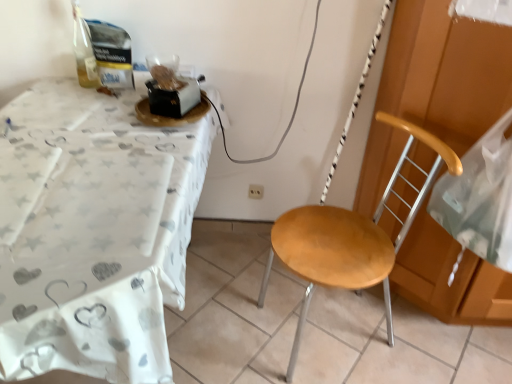
Question: Is white fabric table at left in front of or behind wooden seat at center in the image?

Choices:
 (A) behind
 (B) front

Answer: (B)

Question: Is white fabric table at left wider or thinner than wooden seat at center?

Choices:
 (A) thin
 (B) wide

Answer: (B)

Question: Which is nearer to the transparent plastic bag at right?

Choices:
 (A) white fabric table at left
 (B) white plastic power outlet at center
 (C) wooden seat at center

Answer: (C)

Question: Estimate the real-world distances between objects in this image. Which object is closer to the wooden seat at center?

Choices:
 (A) white fabric table at left
 (B) transparent plastic bag at right
 (C) white plastic power outlet at center

Answer: (B)